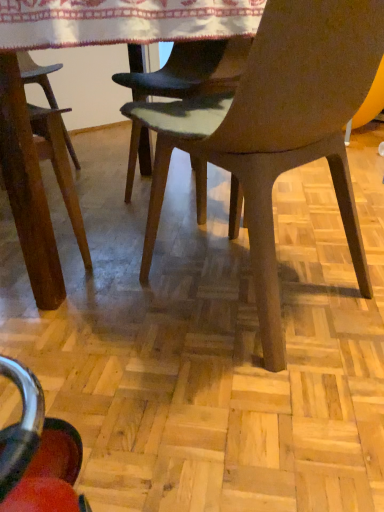
You are a GUI agent. You are given a task and a screenshot of the screen. Output one action in this format:
    pyautogui.click(x=<x>, y=<y>)
    Task: Click on the free space in front of matte brown chair at center
    
    Given the screenshot: What is the action you would take?
    pyautogui.click(x=241, y=409)